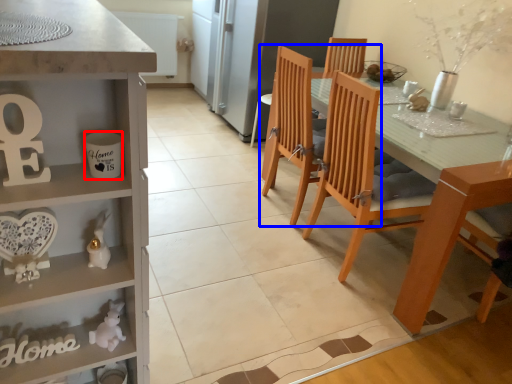
Question: Which object is closer to the camera taking this photo, coffee cup (highlighted by a red box) or chair (highlighted by a blue box)?

Choices:
 (A) coffee cup
 (B) chair

Answer: (A)